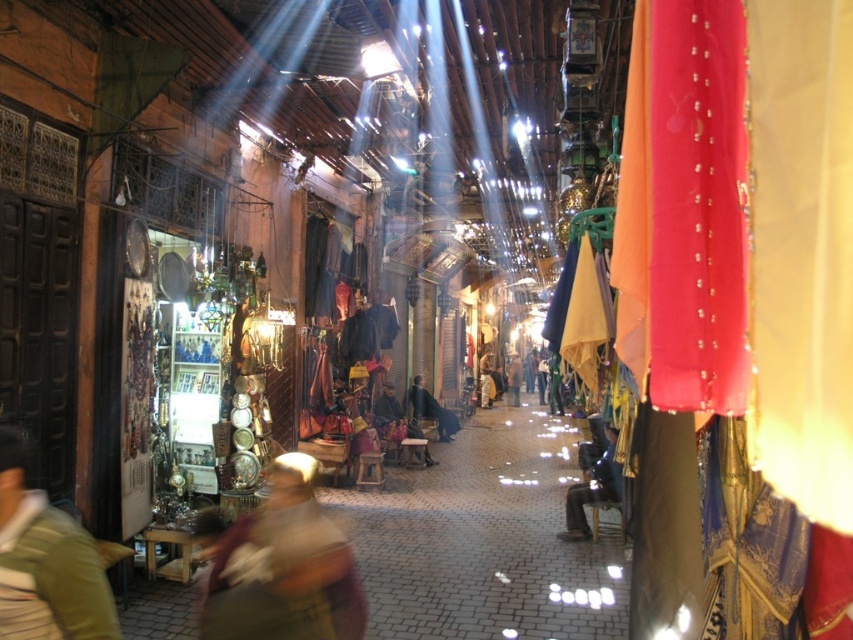
Does green fabric headscarf at center appear on the right side of light brown leather jacket at center?

No, green fabric headscarf at center is not to the right of light brown leather jacket at center.

Which of these two, green fabric headscarf at center or light brown leather jacket at center, stands taller?

Standing taller between the two is light brown leather jacket at center.

Who is more forward, (329, 541) or (512, 404)?

Point (329, 541) is in front.

The width and height of the screenshot is (853, 640). In order to click on green fabric headscarf at center in this screenshot , I will do `click(283, 566)`.

Which is in front, point (286, 589) or point (416, 378)?

Point (286, 589) is in front.

Measure the distance between green fabric headscarf at center and dark brown leather jacket at center.

They are 14.29 meters apart.

Which is behind, point (358, 625) or point (430, 419)?

Positioned behind is point (430, 419).

This screenshot has height=640, width=853. I want to click on green fabric headscarf at center, so click(x=283, y=566).

Does point (601, 474) come farther from viewer compared to point (434, 408)?

No, (601, 474) is closer to viewer.

Locate an element on the screen. This screenshot has height=640, width=853. dark brown leather pants at center is located at coordinates (592, 490).